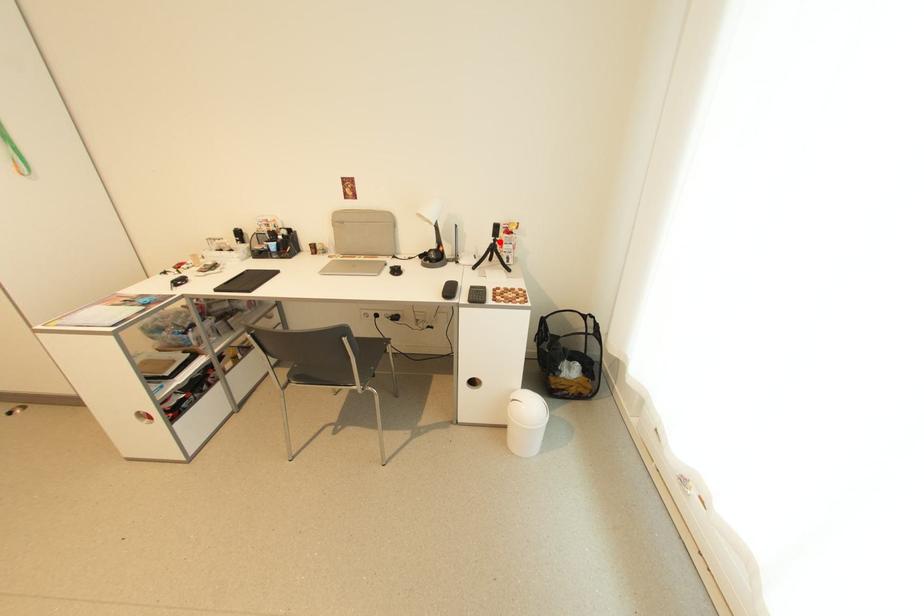
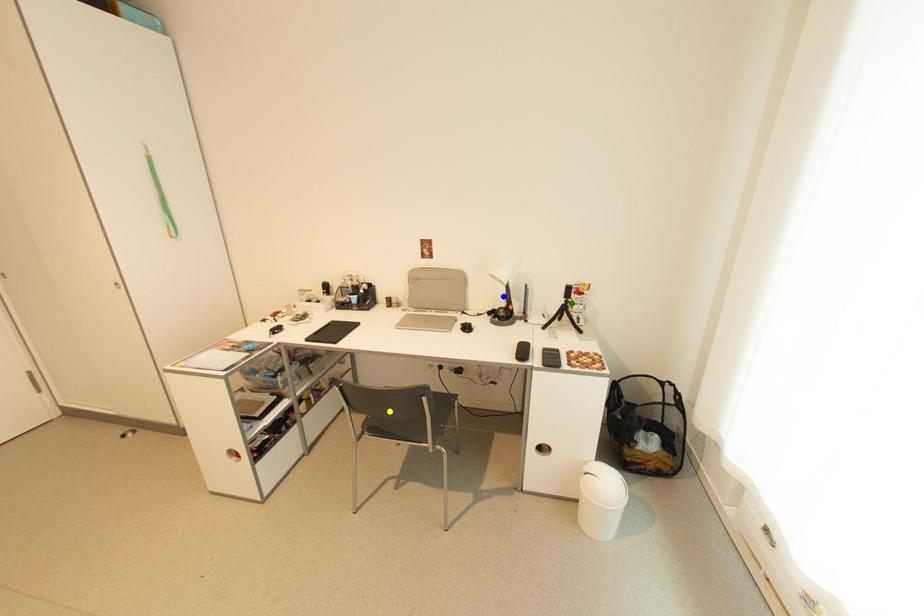
Question: I am providing you with two images of the same scene from different viewpoints. A red point is marked on the first image. You are given multiple points on the second image. In image 2, which mark is for the same physical point as the one in image 1?

Choices:
 (A) yellow point
 (B) green point
 (C) blue point

Answer: (B)